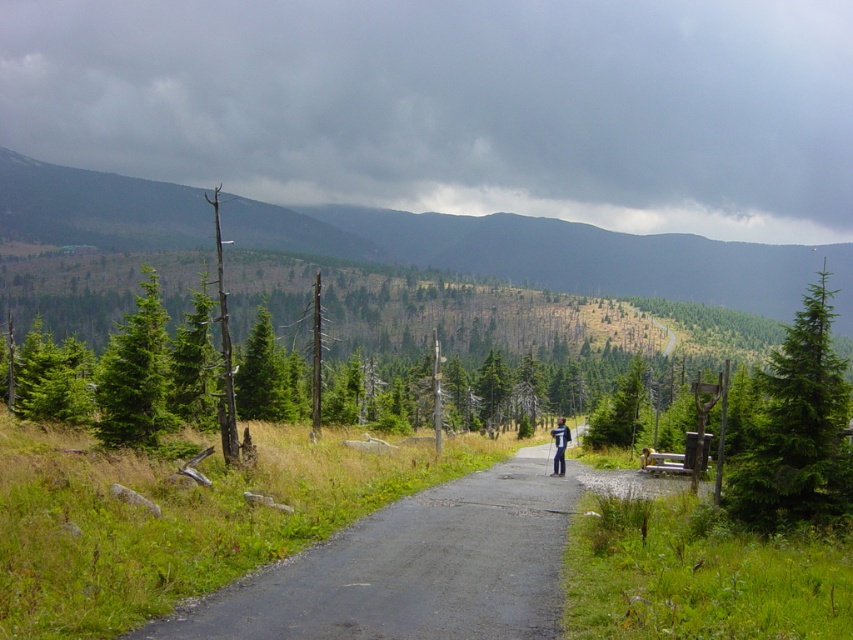
Question: Is green matte tree at right positioned behind green matte tree at left?

Choices:
 (A) no
 (B) yes

Answer: (A)

Question: Does asphalt road at center appear on the left side of green matte tree at left?

Choices:
 (A) yes
 (B) no

Answer: (B)

Question: Which point is farther from the camera taking this photo?

Choices:
 (A) (161, 324)
 (B) (831, 465)
 (C) (520, 518)

Answer: (A)

Question: Which object is closer to the camera taking this photo?

Choices:
 (A) green matte tree at left
 (B) green matte tree at right
 (C) green forested mountain at upper center

Answer: (B)

Question: Which object appears farthest from the camera in this image?

Choices:
 (A) asphalt road at center
 (B) green matte tree at left

Answer: (B)

Question: Does green forested mountain at upper center appear over green matte tree at left?

Choices:
 (A) no
 (B) yes

Answer: (B)